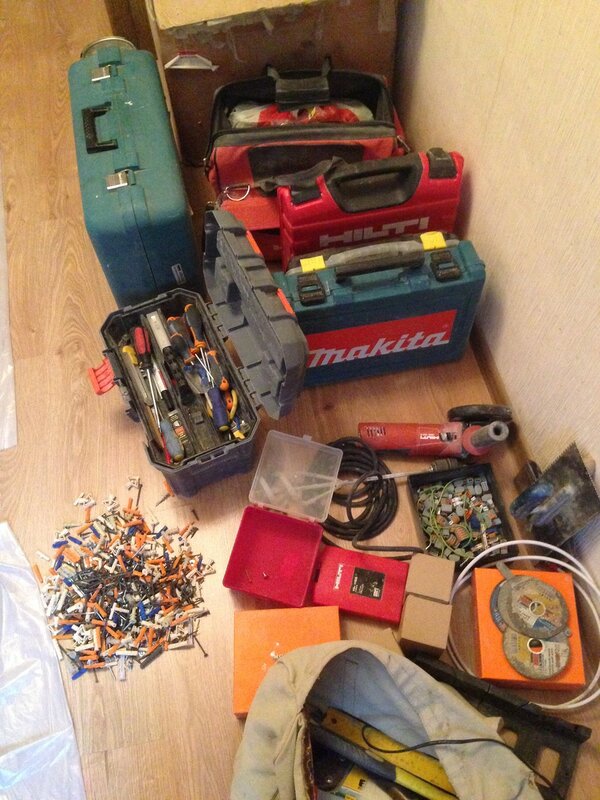
Identify the location of 2 red boxes. (340, 578), (276, 560).